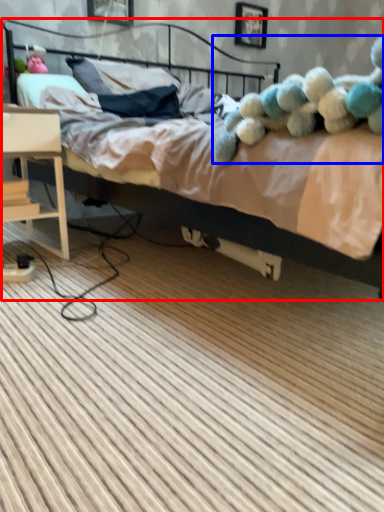
Question: Which point is closer to the camera, bed (highlighted by a red box) or teddy (highlighted by a blue box)?

Choices:
 (A) bed
 (B) teddy

Answer: (A)